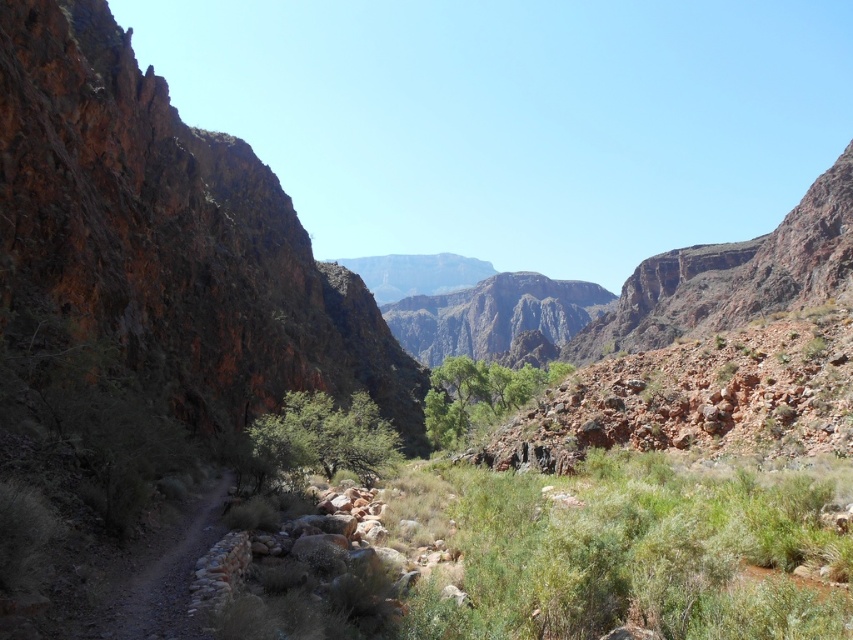
Does rusty rock cliff at left have a larger size compared to green leafy trees at center?

Yes, rusty rock cliff at left is bigger than green leafy trees at center.

Is rusty rock cliff at left shorter than green leafy trees at center?

In fact, rusty rock cliff at left may be taller than green leafy trees at center.

Describe the element at coordinates (171, 236) in the screenshot. I see `rusty rock cliff at left` at that location.

Image resolution: width=853 pixels, height=640 pixels. I want to click on rusty rock cliff at left, so click(171, 236).

Who is more distant from viewer, (328, 404) or (103, 609)?

Positioned behind is point (328, 404).

Which of these two, green leafy bush at center or dirt path at left, stands taller?

green leafy bush at center

Locate an element on the screen. This screenshot has width=853, height=640. green leafy bush at center is located at coordinates (323, 436).

Does green leafy bush at center have a larger size compared to green leafy trees at center?

No, green leafy bush at center is not bigger than green leafy trees at center.

This screenshot has width=853, height=640. What do you see at coordinates (323, 436) in the screenshot? I see `green leafy bush at center` at bounding box center [323, 436].

At what (x,y) coordinates should I click in order to perform the action: click on green leafy bush at center. Please return your answer as a coordinate pair (x, y). Looking at the image, I should click on (323, 436).